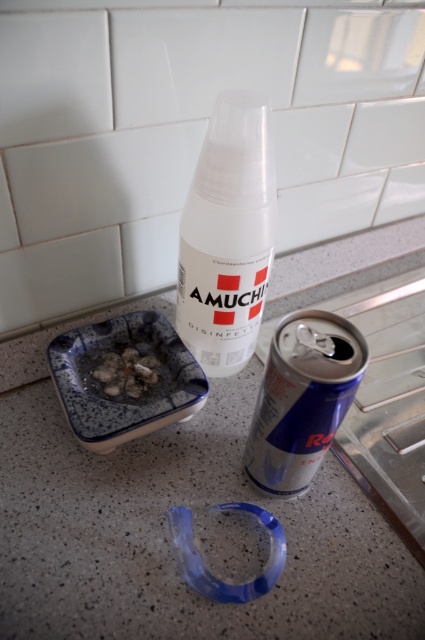
You are organizing items on a kitchen countertop. You have a transparent plastic spray bottle at center and a white crumbly food at center. Where should you place the spray bottle relative to the food to maintain proper cleaning product storage?

The transparent plastic spray bottle at center should be placed to the right of the white crumbly food at center to maintain proper cleaning product storage as per the given arrangement.

You are organizing items on a kitchen countertop. You need to place a blue metallic can at center and a white crumbly food at center. According to the scene, where should you position the blue metallic can relative to the white crumbly food?

The blue metallic can at center should be positioned to the right of the white crumbly food at center.

You are organizing items on a countertop and need to place a new item between the transparent plastic spray bottle at center and the blue metallic can at center. Based on their positions, where should you place the new item?

The blue metallic can at center is behind the transparent plastic spray bottle at center, so placing the new item in front of the transparent plastic spray bottle at center would position it between the two objects.